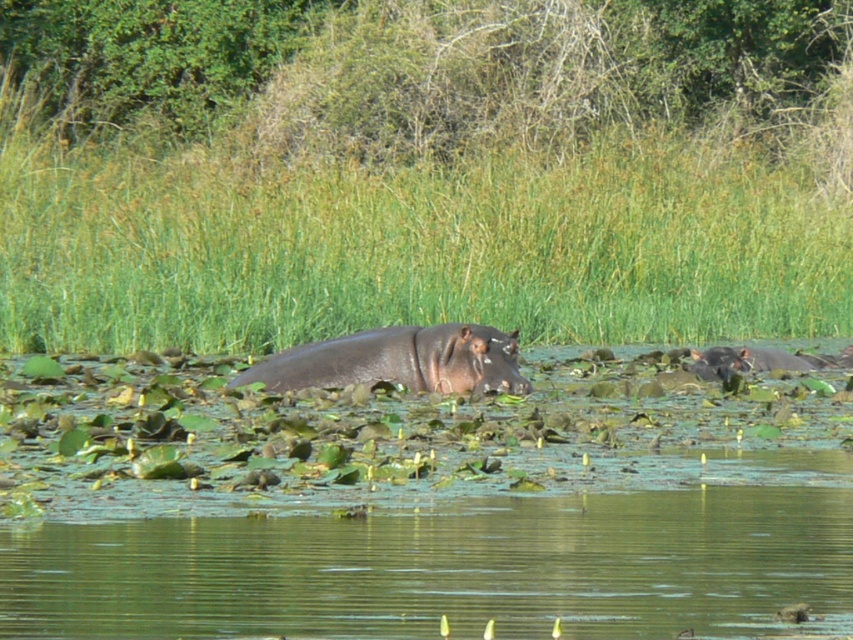
Can you confirm if green grass at center is positioned to the right of dark gray skin at right?

Incorrect, green grass at center is not on the right side of dark gray skin at right.

Which of these two, green grass at center or dark gray skin at right, stands shorter?

With less height is dark gray skin at right.

Does point (497, 240) come in front of point (700, 365)?

No, (497, 240) is behind (700, 365).

Find the location of a particular element. This screenshot has width=853, height=640. green grass at center is located at coordinates (416, 246).

Between sleek dark brown hippo at center and dark gray skin at right, which one has more height?

Standing taller between the two is sleek dark brown hippo at center.

Does sleek dark brown hippo at center have a greater height compared to dark gray skin at right?

Correct, sleek dark brown hippo at center is much taller as dark gray skin at right.

I want to click on sleek dark brown hippo at center, so click(399, 360).

The image size is (853, 640). I want to click on sleek dark brown hippo at center, so click(399, 360).

How distant is green grass at center from sleek dark brown hippo at center?

8.30 meters

Who is lower down, green grass at center or sleek dark brown hippo at center?

sleek dark brown hippo at center is below.

Image resolution: width=853 pixels, height=640 pixels. What do you see at coordinates (416, 246) in the screenshot?
I see `green grass at center` at bounding box center [416, 246].

Locate an element on the screen. The height and width of the screenshot is (640, 853). green grass at center is located at coordinates (416, 246).